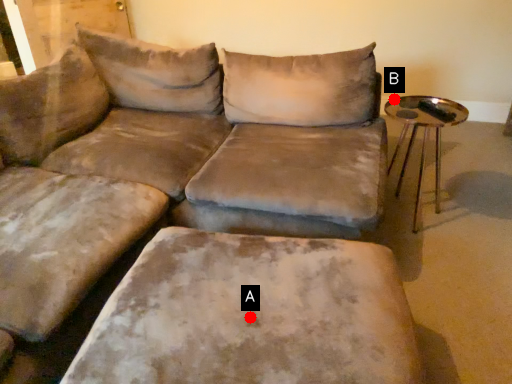
Question: Two points are circled on the image, labeled by A and B beside each circle. Among these points, which one is nearest to the camera?

Choices:
 (A) A is closer
 (B) B is closer

Answer: (A)